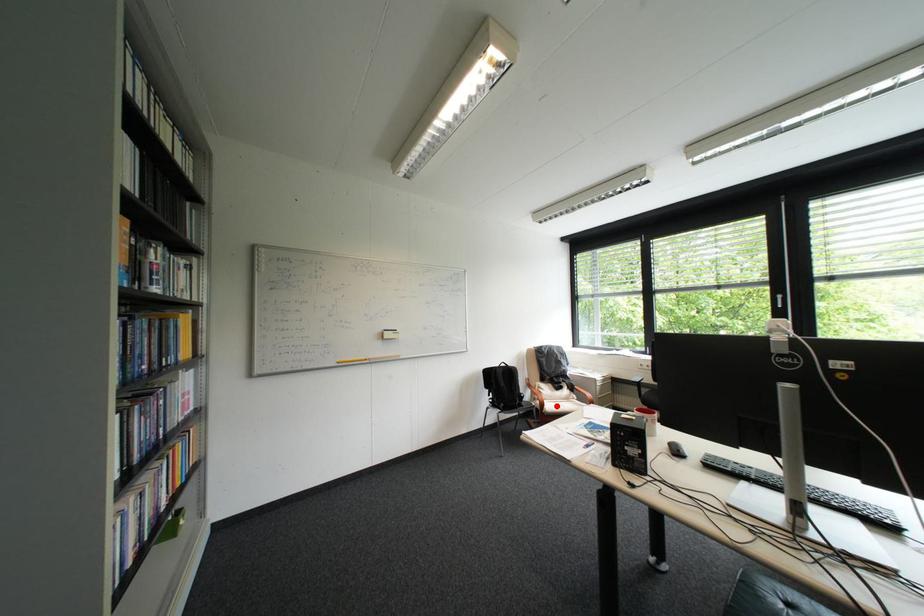
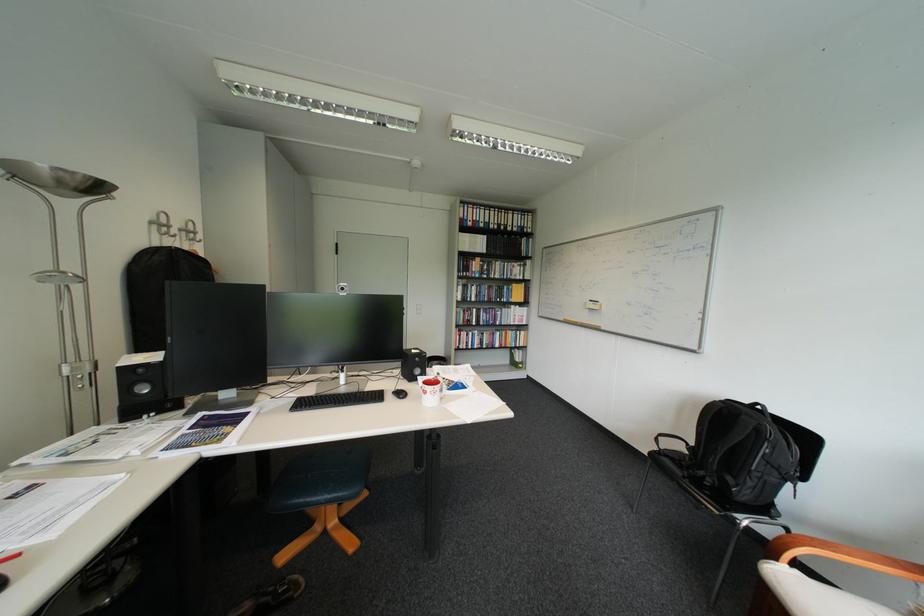
Question: I am providing you with two images of the same scene from different viewpoints. Image1 has a red point marked. In image2, the corresponding 3D location appears at what relative position? Reply with the corresponding letter.

Choices:
 (A) Closer
 (B) Farther

Answer: (A)